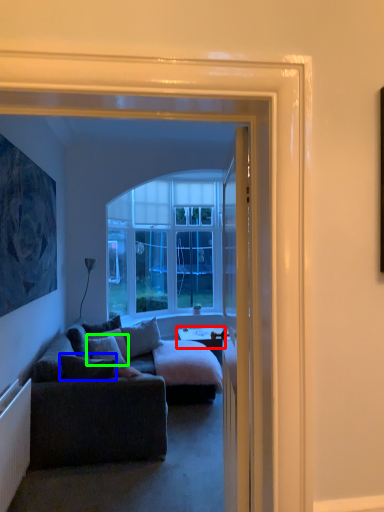
Question: Considering the real-world distances, which object is closest to desk (highlighted by a red box)? pillow (highlighted by a blue box) or pillow (highlighted by a green box).

Choices:
 (A) pillow
 (B) pillow

Answer: (B)